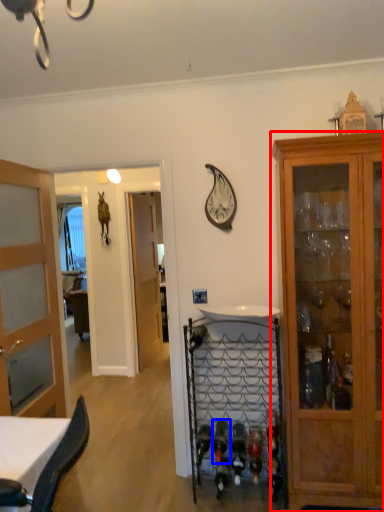
Question: Among these objects, which one is farthest to the camera, cabinetry (highlighted by a red box) or wine bottle (highlighted by a blue box)?

Choices:
 (A) cabinetry
 (B) wine bottle

Answer: (B)